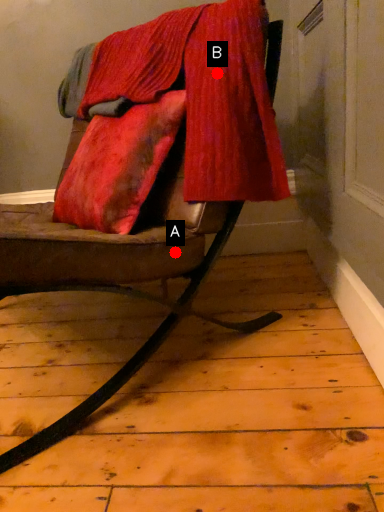
Question: Two points are circled on the image, labeled by A and B beside each circle. Which point is farther to the camera?

Choices:
 (A) A is further
 (B) B is further

Answer: (B)